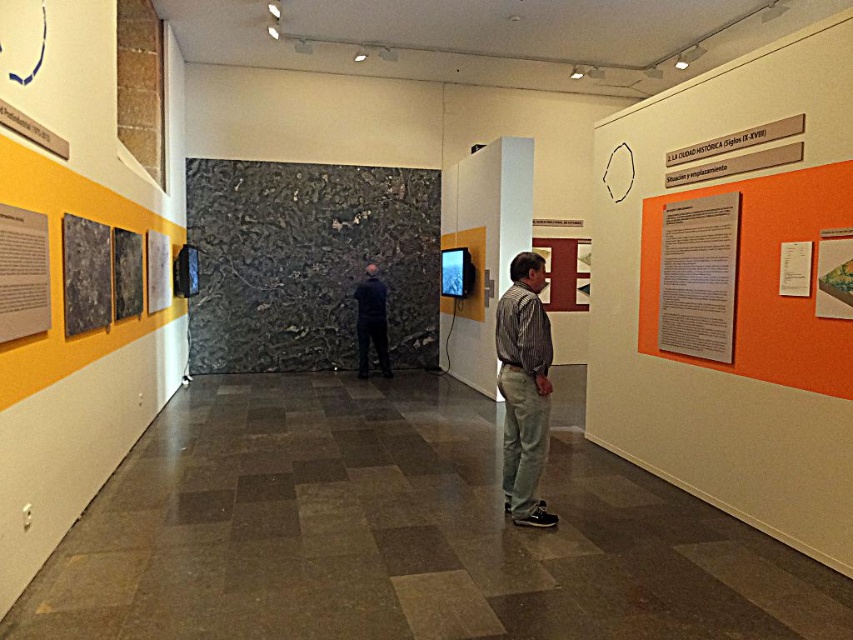
Which of these two, matte paper poster at left or matte paper map at upper right, stands shorter?

With less height is matte paper map at upper right.

Does point (9, 273) come in front of point (824, 264)?

Yes, point (9, 273) is closer to viewer.

In order to click on matte paper poster at left in this screenshot , I will do `click(22, 273)`.

The width and height of the screenshot is (853, 640). In order to click on matte paper poster at left in this screenshot , I will do `click(22, 273)`.

Is matte paper map at upper right to the left of dark blue fabric at center from the viewer's perspective?

No, matte paper map at upper right is not to the left of dark blue fabric at center.

At what (x,y) coordinates should I click in order to perform the action: click on matte paper map at upper right. Please return your answer as a coordinate pair (x, y). The image size is (853, 640). Looking at the image, I should click on (834, 275).

Locate an element on the screen. The image size is (853, 640). matte paper map at upper right is located at coordinates coord(834,275).

Does black textured wall at center have a smaller size compared to matte paper poster at left?

No, black textured wall at center is not smaller than matte paper poster at left.

Is black textured wall at center in front of matte paper poster at left?

No, it is behind matte paper poster at left.

Identify the location of black textured wall at center. The height and width of the screenshot is (640, 853). (306, 262).

What are the coordinates of `black textured wall at center` in the screenshot? It's located at (306, 262).